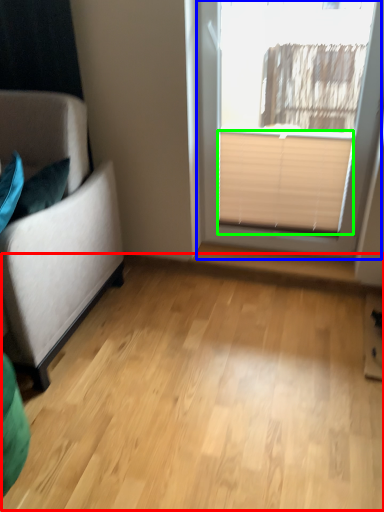
Question: Which object is positioned closest to plain (highlighted by a red box)? Select from window (highlighted by a blue box) and blind (highlighted by a green box).

Choices:
 (A) window
 (B) blind

Answer: (B)